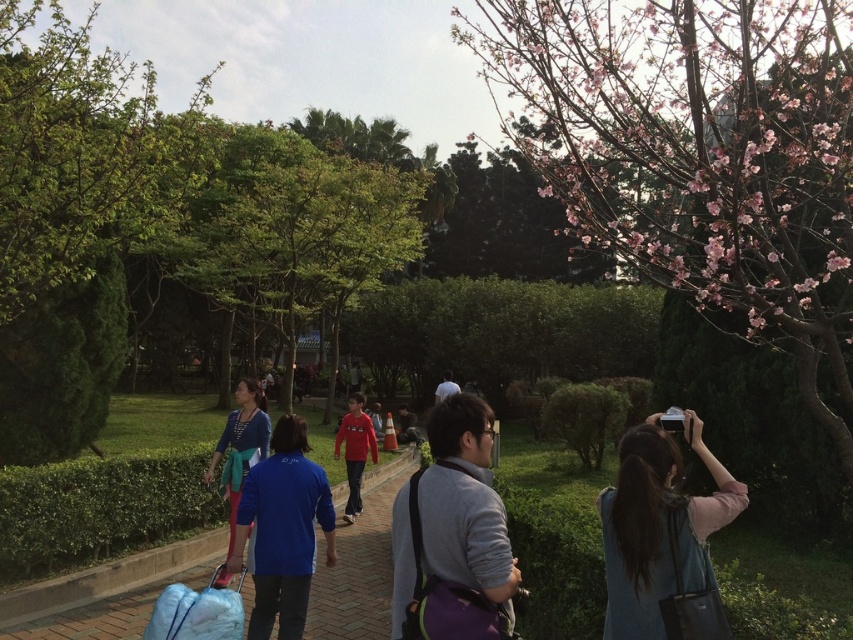
You are a photographer standing at the end of the paved pathway in the park. You want to take a photo that includes both the blue fabric jacket at center and the matte red sweater at center. Since you want to emphasize the size difference between them, which one should you position closer to the camera to achieve this effect?

To emphasize the size difference between the blue fabric jacket at center and the matte red sweater at center, you should position the blue fabric jacket at center closer to the camera because it is larger in size than the matte red sweater at center.

You are a photographer standing at the center of the park pathway. You see the gray fabric backpack at center. Where would you position your camera to capture the backpack in the frame?

The gray fabric backpack at center is located at the coordinates 0.838 on the x axis and 0.531 on the y axis, so you should position your camera to aim towards those coordinates to capture the backpack in the frame.